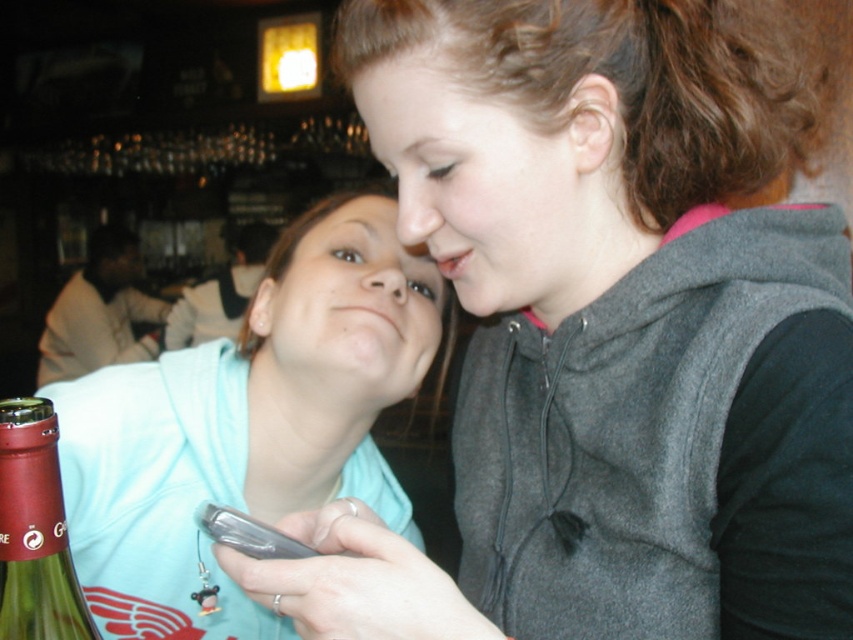
Which is more to the right, light blue hoodie at center or green glass bottle at lower left?

light blue hoodie at center is more to the right.

Measure the distance from light blue hoodie at center to green glass bottle at lower left.

14.94 inches

Does point (405, 273) lie in front of point (56, 618)?

No, it is behind (56, 618).

Identify the location of light blue hoodie at center. (247, 424).